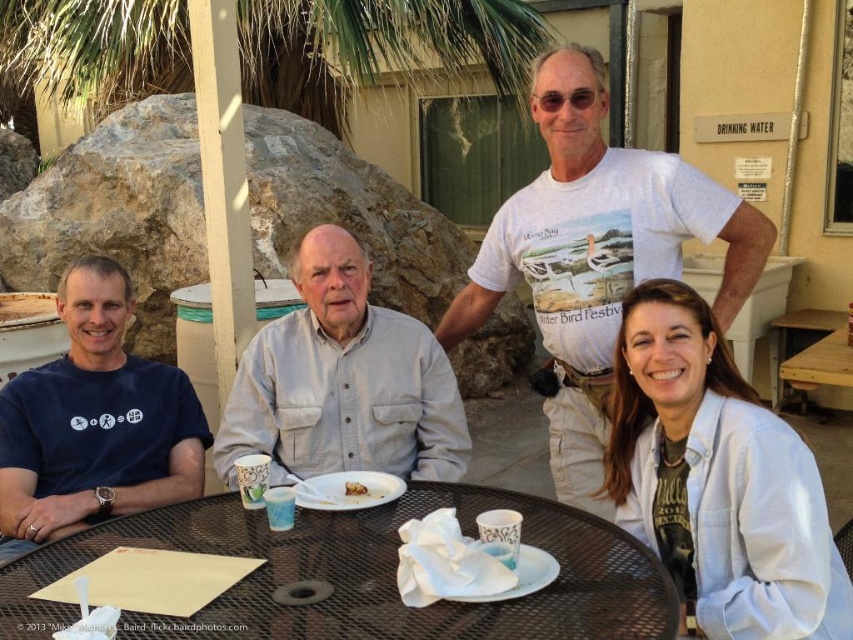
Who is taller, blue cotton t-shirt at left or brown wooden table at lower right?

blue cotton t-shirt at left is taller.

This screenshot has width=853, height=640. I want to click on blue cotton t-shirt at left, so click(96, 420).

Between metallic round table at center and brown wooden table at lower right, which one has less height?

metallic round table at center is shorter.

Can you confirm if metallic round table at center is shorter than brown wooden table at lower right?

Yes, metallic round table at center is shorter than brown wooden table at lower right.

Is point (276, 572) less distant than point (844, 380)?

Yes, point (276, 572) is closer to viewer.

You are a GUI agent. You are given a task and a screenshot of the screen. Output one action in this format:
    pyautogui.click(x=<x>, y=<y>)
    Task: Click on the metallic round table at center
    Image resolution: width=853 pixels, height=640 pixels.
    Given the screenshot: What is the action you would take?
    pyautogui.click(x=360, y=573)

What are the coordinates of `white denim jacket at lower right` in the screenshot? It's located at (717, 481).

Does white denim jacket at lower right come in front of gray cotton shirt at center?

Yes, white denim jacket at lower right is in front of gray cotton shirt at center.

Is point (793, 515) in front of point (416, 419)?

Yes, point (793, 515) is closer to viewer.

In order to click on white denim jacket at lower right in this screenshot , I will do `click(717, 481)`.